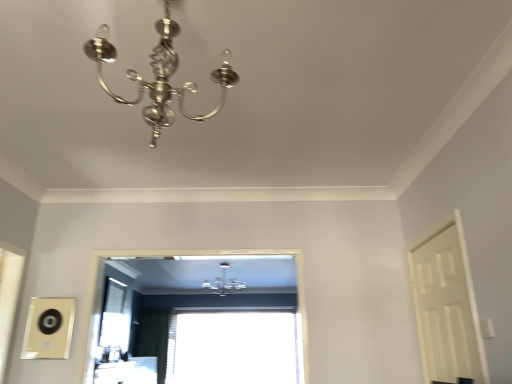
What do you see at coordinates (159, 75) in the screenshot? This screenshot has height=384, width=512. I see `polished silver chandelier at upper center, arranged as the 2th lamp when ordered from the bottom` at bounding box center [159, 75].

Identify the location of satin silver chandelier at upper center, the 1th lamp from the bottom. The width and height of the screenshot is (512, 384). (224, 282).

In order to click on transparent glass window at center, the 1th window from the bottom in this screenshot , I will do tap(234, 347).

How different are the orientations of satin silver chandelier at upper center, which is the 2th lamp in front-to-back order, and transparent glass window at center, positioned as the second window in front-to-back order, in degrees?

1.75 degrees separate the facing orientations of satin silver chandelier at upper center, which is the 2th lamp in front-to-back order, and transparent glass window at center, positioned as the second window in front-to-back order.

From the image's perspective, is satin silver chandelier at upper center, the 1th lamp from the bottom, over transparent glass window at center, the 1th window from the bottom?

Yes, from the image's perspective, satin silver chandelier at upper center, the 1th lamp from the bottom, is on top of transparent glass window at center, the 1th window from the bottom.

Is point (223, 282) farther from viewer compared to point (219, 328)?

No, it is in front of (219, 328).

Based on the photo, is transparent glass window at center, which ranks as the first window in back-to-front order, inside satin silver chandelier at upper center, which is the 2th lamp in front-to-back order?

No.

Measure the distance from transparent glass window at center, the 1th window from the bottom, to satin silver chandelier at upper center, the 1th lamp from the bottom.

→ They are 32.31 inches apart.

Can satin silver chandelier at upper center, the 1th lamp from the bottom, be found inside transparent glass window at center, the 1th window from the bottom?

No, satin silver chandelier at upper center, the 1th lamp from the bottom, is not surrounded by transparent glass window at center, the 1th window from the bottom.

Based on the photo, is transparent glass window at center, arranged as the 2th window when viewed from the top, wider than satin silver chandelier at upper center, the 1th lamp from the bottom?

No, transparent glass window at center, arranged as the 2th window when viewed from the top, is not wider than satin silver chandelier at upper center, the 1th lamp from the bottom.

Is transparent glass window at center, positioned as the second window in front-to-back order, facing away from satin silver chandelier at upper center, placed as the 1th lamp when sorted from back to front?

No.

Considering the relative positions of transparent glass window at center, the 1th window from the bottom, and white matte door at right in the image provided, is transparent glass window at center, the 1th window from the bottom, to the left of white matte door at right from the viewer's perspective?

Indeed, transparent glass window at center, the 1th window from the bottom, is positioned on the left side of white matte door at right.

Is the surface of transparent glass window at center, positioned as the second window in front-to-back order, in direct contact with white matte door at right?

There is a gap between transparent glass window at center, positioned as the second window in front-to-back order, and white matte door at right.

Is the depth of transparent glass window at center, the 1th window from the bottom, less than that of white matte door at right?

No.

From a real-world perspective, who is located higher, transparent glass window at center, which ranks as the first window in back-to-front order, or polished silver chandelier at upper center, the 1th lamp in the top-to-bottom sequence?

polished silver chandelier at upper center, the 1th lamp in the top-to-bottom sequence, is physically above.

Does transparent glass window at center, arranged as the 2th window when viewed from the top, have a smaller size compared to polished silver chandelier at upper center, arranged as the 2th lamp when ordered from the bottom?

Actually, transparent glass window at center, arranged as the 2th window when viewed from the top, might be larger than polished silver chandelier at upper center, arranged as the 2th lamp when ordered from the bottom.

In order to click on window that is the 2nd one below the polished silver chandelier at upper center, marked as the second lamp in a back-to-front arrangement (from a real-world perspective) in this screenshot , I will do `click(234, 347)`.

Is transparent glass window at center, the 1th window from the bottom, touching polished silver chandelier at upper center, arranged as the 2th lamp when ordered from the bottom?

They are not placed beside each other.

In the image, is satin silver chandelier at upper center, placed as the 1th lamp when sorted from back to front, positioned in front of or behind white matte door at right?

Clearly, satin silver chandelier at upper center, placed as the 1th lamp when sorted from back to front, is behind white matte door at right.

Would you say satin silver chandelier at upper center, the 1th lamp from the bottom, contains white matte door at right?

No, white matte door at right is located outside of satin silver chandelier at upper center, the 1th lamp from the bottom.

Is point (207, 285) closer to viewer compared to point (425, 370)?

No, it is not.

From a real-world perspective, relative to transparent glass window at center, which is the first window from front to back, is satin silver chandelier at upper center, placed as the 1th lamp when sorted from back to front, vertically above or below?

Clearly, from a real-world perspective, satin silver chandelier at upper center, placed as the 1th lamp when sorted from back to front, is above transparent glass window at center, which is the first window from front to back.

Locate an element on the screen. This screenshot has height=384, width=512. lamp that is below the transparent glass window at center, which appears as the second window when ordered from the bottom (from the image's perspective) is located at coordinates (224, 282).

Is satin silver chandelier at upper center, the 1th lamp from the bottom, shorter than transparent glass window at center, acting as the 1th window starting from the top?

Yes.

From the image's perspective, which one is positioned lower, satin silver chandelier at upper center, marked as the second lamp in a top-to-bottom arrangement, or transparent glass window at center, which is the first window from front to back?

satin silver chandelier at upper center, marked as the second lamp in a top-to-bottom arrangement, is shown below in the image.

Can white matte door at right be found inside polished silver chandelier at upper center, the 1th lamp in the top-to-bottom sequence?

Actually, white matte door at right is outside polished silver chandelier at upper center, the 1th lamp in the top-to-bottom sequence.

Image resolution: width=512 pixels, height=384 pixels. Identify the location of screen door directly beneath the polished silver chandelier at upper center, which ranks as the first lamp in front-to-back order (from a real-world perspective). [446, 307].

Is polished silver chandelier at upper center, which ranks as the first lamp in front-to-back order, wider or thinner than white matte door at right?

In the image, polished silver chandelier at upper center, which ranks as the first lamp in front-to-back order, appears to be wider than white matte door at right.

Is polished silver chandelier at upper center, arranged as the 2th lamp when ordered from the bottom, turned away from white matte door at right?

No, polished silver chandelier at upper center, arranged as the 2th lamp when ordered from the bottom,'s orientation is not away from white matte door at right.

This screenshot has height=384, width=512. Identify the location of window behind the satin silver chandelier at upper center, which is the 2th lamp in front-to-back order. (234, 347).

Locate an element on the screen. The image size is (512, 384). the 2nd window positioned below the satin silver chandelier at upper center, marked as the second lamp in a top-to-bottom arrangement (from a real-world perspective) is located at coordinates (234, 347).

When comparing their distances from white matte door at right, does satin silver chandelier at upper center, marked as the second lamp in a top-to-bottom arrangement, or polished silver chandelier at upper center, which ranks as the first lamp in front-to-back order, seem further?

satin silver chandelier at upper center, marked as the second lamp in a top-to-bottom arrangement.

Looking at the image, which one is located further to transparent glass window at center, arranged as the 2th window when viewed from the top, polished silver chandelier at upper center, arranged as the 2th lamp when ordered from the bottom, or satin silver chandelier at upper center, the 1th lamp from the bottom?

The object further to transparent glass window at center, arranged as the 2th window when viewed from the top, is polished silver chandelier at upper center, arranged as the 2th lamp when ordered from the bottom.

From the image, which object appears to be nearer to satin silver chandelier at upper center, placed as the 1th lamp when sorted from back to front, white matte door at right or transparent glass window at center, which appears as the second window when ordered from the bottom?

transparent glass window at center, which appears as the second window when ordered from the bottom, lies closer to satin silver chandelier at upper center, placed as the 1th lamp when sorted from back to front, than the other object.

Based on their spatial positions, is white matte door at right or transparent glass window at center, positioned as the second window in front-to-back order, further from satin silver chandelier at upper center, marked as the second lamp in a top-to-bottom arrangement?

white matte door at right lies further to satin silver chandelier at upper center, marked as the second lamp in a top-to-bottom arrangement, than the other object.

Looking at the image, which one is located further to transparent glass window at center, positioned as the second window in front-to-back order, white matte door at right or satin silver chandelier at upper center, which is the 2th lamp in front-to-back order?

white matte door at right is positioned further to the anchor transparent glass window at center, positioned as the second window in front-to-back order.

Estimate the real-world distances between objects in this image. Which object is closer to transparent glass window at center, which appears as the second window when ordered from the bottom, polished silver chandelier at upper center, the 1th lamp in the top-to-bottom sequence, or white matte door at right?

Among the two, white matte door at right is located nearer to transparent glass window at center, which appears as the second window when ordered from the bottom.

Based on the photo, which object lies further to the anchor point polished silver chandelier at upper center, arranged as the 2th lamp when ordered from the bottom, white matte door at right or transparent glass window at center, which appears as the second window when ordered from the bottom?

transparent glass window at center, which appears as the second window when ordered from the bottom, is positioned further to the anchor polished silver chandelier at upper center, arranged as the 2th lamp when ordered from the bottom.

Which object lies further to the anchor point white matte door at right, polished silver chandelier at upper center, the 1th lamp in the top-to-bottom sequence, or transparent glass window at center, which is the first window from front to back?

Based on the image, transparent glass window at center, which is the first window from front to back, appears to be further to white matte door at right.

Where is `screen door between polished silver chandelier at upper center, which ranks as the first lamp in front-to-back order, and satin silver chandelier at upper center, the 1th lamp from the bottom, from front to back`? screen door between polished silver chandelier at upper center, which ranks as the first lamp in front-to-back order, and satin silver chandelier at upper center, the 1th lamp from the bottom, from front to back is located at coordinates (446, 307).

Locate an element on the screen. lamp positioned between transparent glass window at center, the second window in the back-to-front sequence, and transparent glass window at center, arranged as the 2th window when viewed from the top, from near to far is located at coordinates (224, 282).

The height and width of the screenshot is (384, 512). In order to click on lamp located between white matte door at right and transparent glass window at center, the 1th window from the bottom, in the depth direction in this screenshot , I will do `click(224, 282)`.

Image resolution: width=512 pixels, height=384 pixels. I want to click on window between white matte door at right and satin silver chandelier at upper center, which is the 2th lamp in front-to-back order, along the z-axis, so click(237, 348).